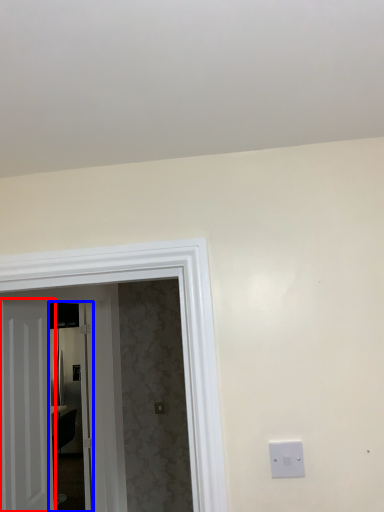
Question: Which object appears closest to the camera in this image, door (highlighted by a red box) or glass door (highlighted by a blue box)?

Choices:
 (A) door
 (B) glass door

Answer: (A)